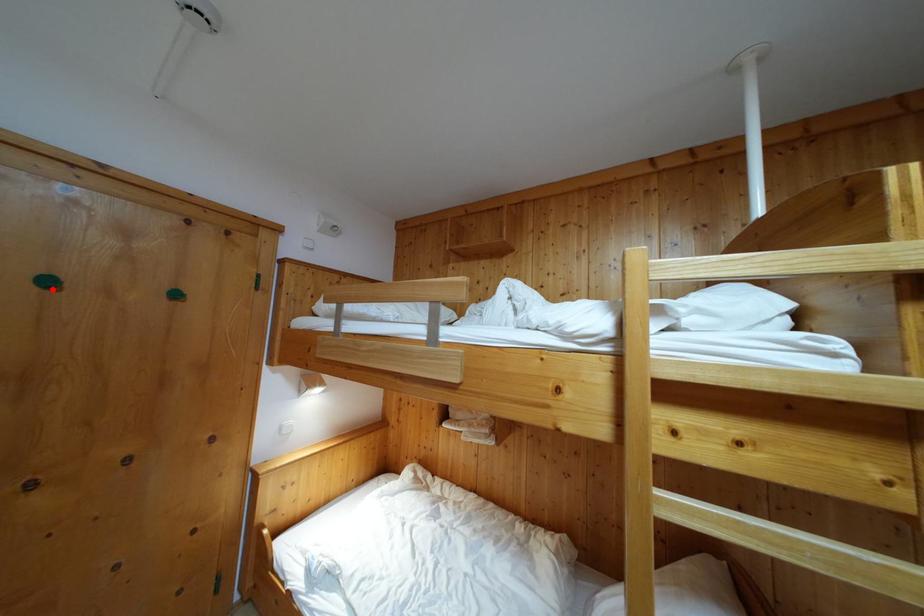
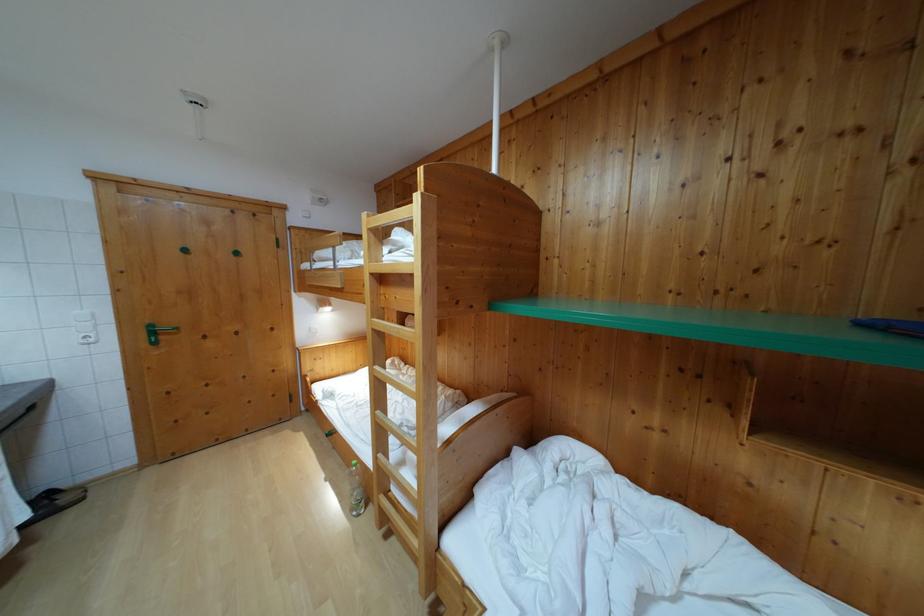
Locate, in the second image, the point that corresponds to the highlighted location in the first image.

(189, 257)